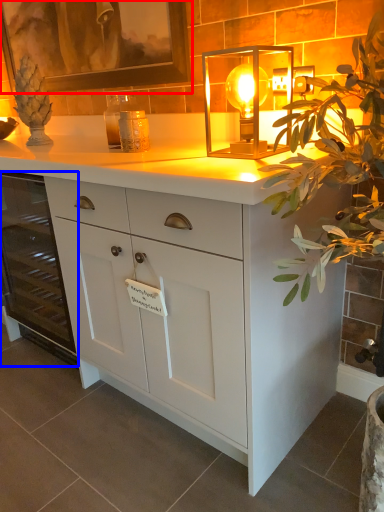
Question: Which of the following is the closest to the observer, picture frame (highlighted by a red box) or cabinetry (highlighted by a blue box)?

Choices:
 (A) picture frame
 (B) cabinetry

Answer: (A)